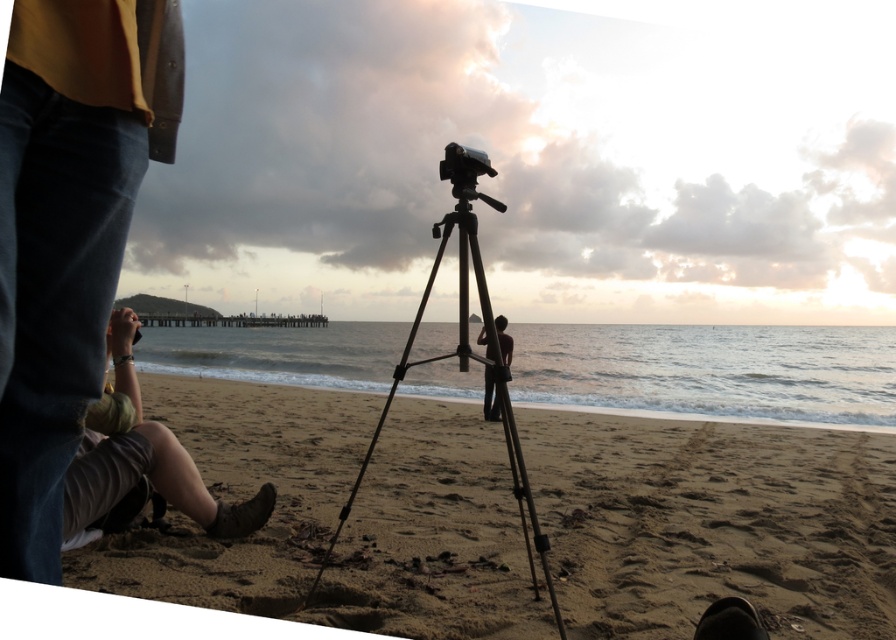
You are a photographer trying to set up your equipment on the sandy beach at lower center. The metallic tripod at center is already placed there. Can you fit another tripod of the same size next to it without overlapping?

The sandy beach at lower center is bigger than the metallic tripod at center, so there is enough space to place another tripod of the same size next to it without overlapping.

You are standing at the center of the image and want to walk to the sandy beach at lower center. Which direction should you move?

Since the sandy beach at lower center is located at coordinates approximately 0.817 on the x axis and 0.797 on the y axis, you should move towards the lower center direction to reach it.